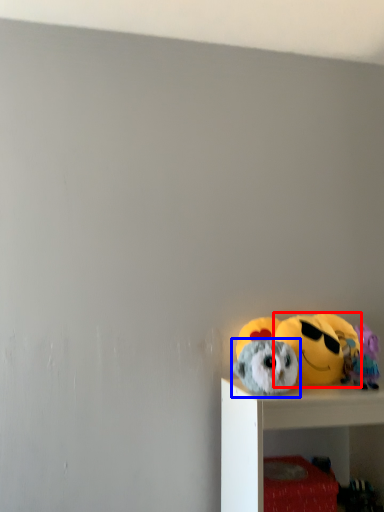
Question: Which of the following is the farthest to the observer, toy (highlighted by a red box) or toy (highlighted by a blue box)?

Choices:
 (A) toy
 (B) toy

Answer: (A)